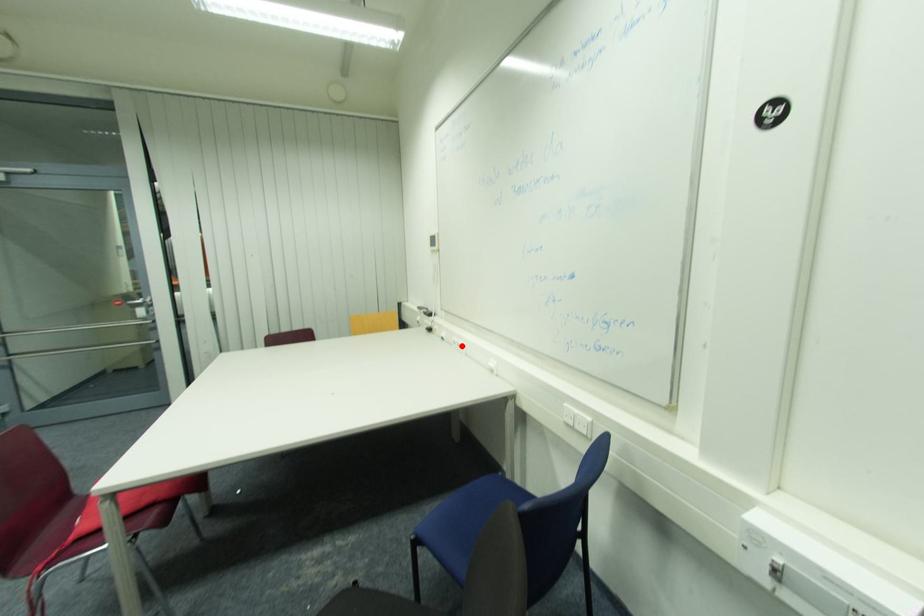
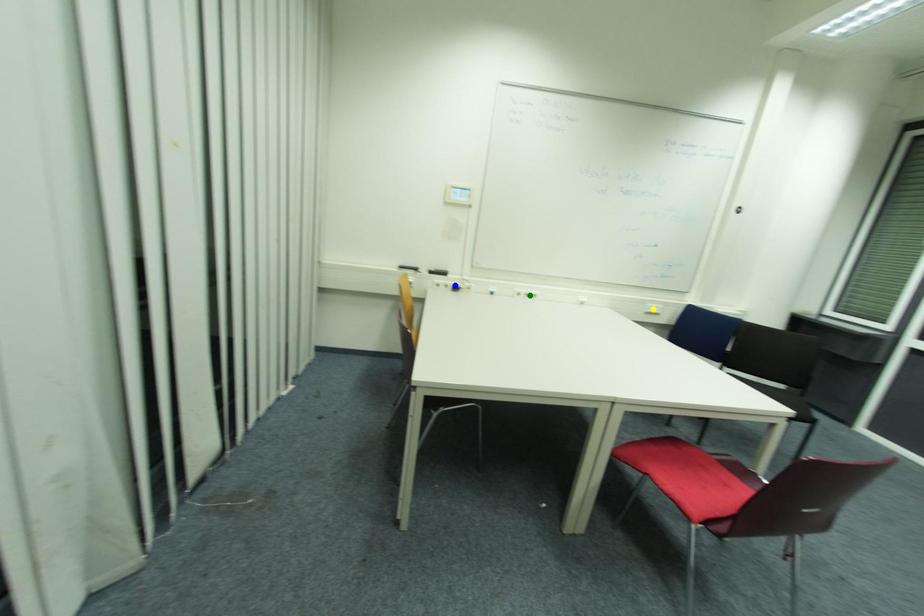
Question: I am providing you with two images of the same scene from different viewpoints. A red point is marked on the first image. You are given multiple points on the second image. Which spot in image 2 lines up with the point in image 1?

Choices:
 (A) green point
 (B) yellow point
 (C) blue point

Answer: (A)